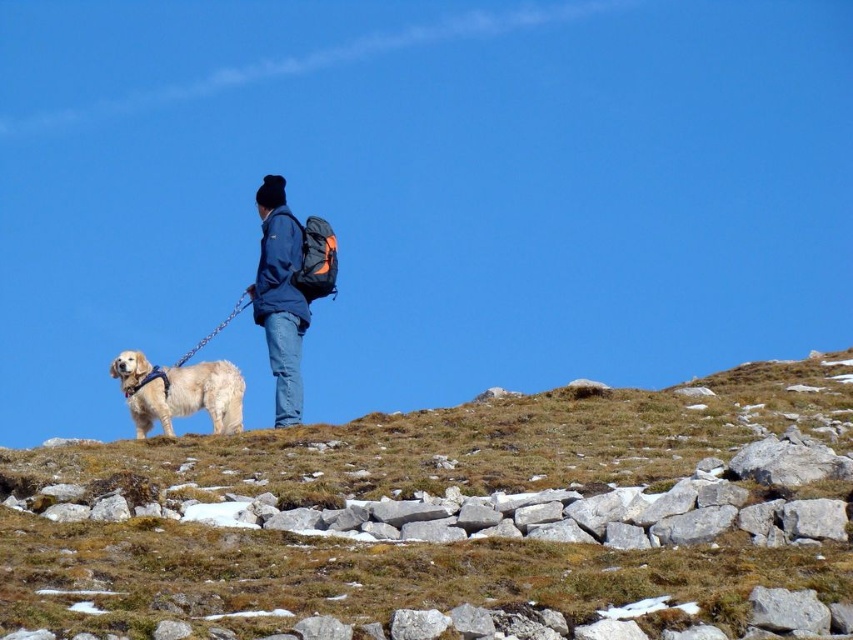
Question: Which object is farther from the camera taking this photo?

Choices:
 (A) golden fur dog at left
 (B) brown grassy hillside at lower center
 (C) blue denim jacket at center

Answer: (C)

Question: Can you confirm if blue denim jacket at center is smaller than golden fur dog at left?

Choices:
 (A) no
 (B) yes

Answer: (A)

Question: Which object is farther from the camera taking this photo?

Choices:
 (A) blue denim jacket at center
 (B) brown grassy hillside at lower center

Answer: (A)

Question: Which object is farther from the camera taking this photo?

Choices:
 (A) blue denim jacket at center
 (B) golden fur dog at left

Answer: (A)

Question: Is blue denim jacket at center positioned behind golden fur dog at left?

Choices:
 (A) no
 (B) yes

Answer: (B)

Question: Is blue denim jacket at center above golden fur dog at left?

Choices:
 (A) yes
 (B) no

Answer: (A)